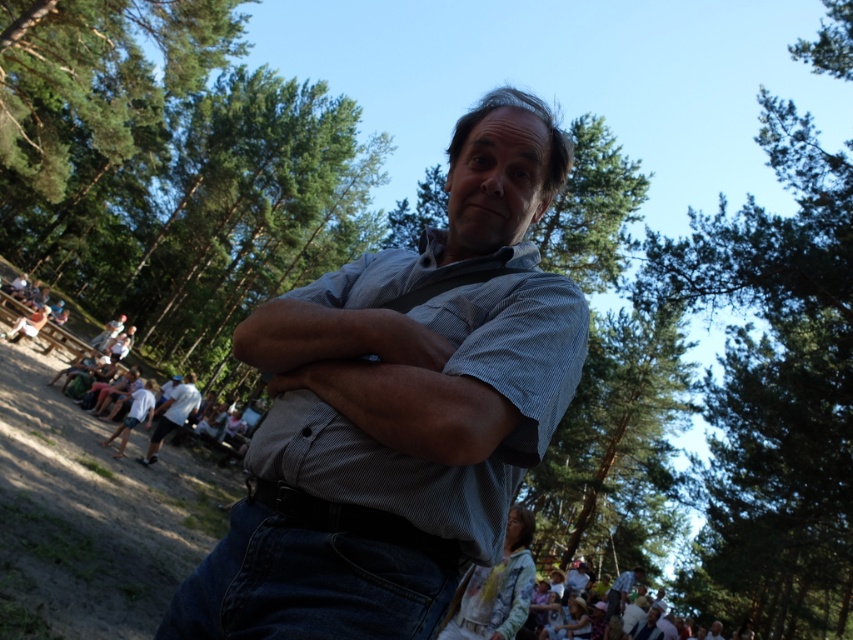
You are organizing a clothing donation drive and need to categorize shirts based on their sizes. You have two shirts in front of you in the image described above. The first is the white cotton shirt at lower left and the second is the blue striped shirt at center. Which shirt has a larger width measurement?

The white cotton shirt at lower left has a larger width measurement than the blue striped shirt at center, as stated in the description that the white cotton shirt at lower left surpasses the blue striped shirt at center in width.

You are standing in the forest gathering and want to move from the central man to the group of seated people. Which direction should you move to go from point (x=387, y=509) to point (x=161, y=408)?

To move from point (x=387, y=509) to point (x=161, y=408), you should move towards the lower left direction since point (x=161, y=408) is further away from the viewer compared to point (x=387, y=509).